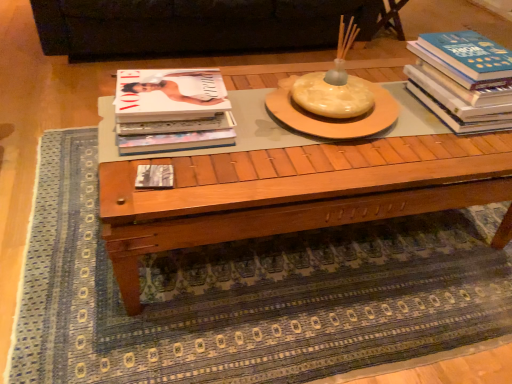
Where is `vacant area that lies to the right of matte white magazine at left, which appears as the 2th book when viewed from the right`? vacant area that lies to the right of matte white magazine at left, which appears as the 2th book when viewed from the right is located at coordinates (265, 141).